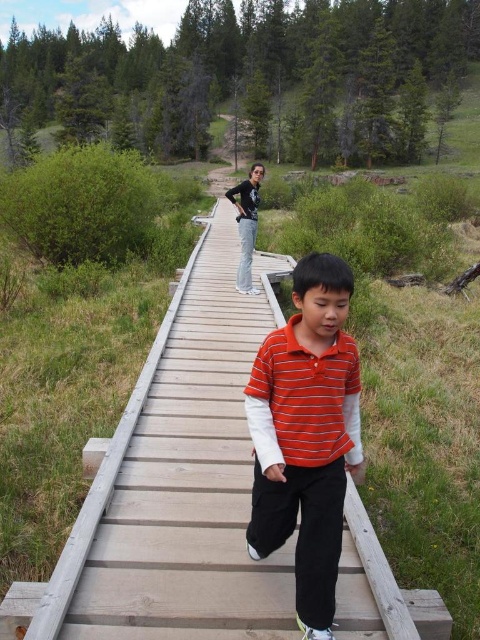
Can you confirm if wooden bridge at center is positioned to the right of orange striped shirt at center?

In fact, wooden bridge at center is to the left of orange striped shirt at center.

Does wooden bridge at center have a larger size compared to orange striped shirt at center?

Correct, wooden bridge at center is larger in size than orange striped shirt at center.

Between point (41, 634) and point (314, 422), which one is positioned in front?

Point (41, 634)

Image resolution: width=480 pixels, height=640 pixels. In order to click on wooden bridge at center in this screenshot , I will do `click(175, 483)`.

From the picture: Is orange striped shirt at center thinner than black cotton pants at center?

No, orange striped shirt at center is not thinner than black cotton pants at center.

Is point (337, 541) farther from camera compared to point (249, 216)?

No.

Find the location of a particular element. The width and height of the screenshot is (480, 640). orange striped shirt at center is located at coordinates (305, 435).

What are the coordinates of `orange striped shirt at center` in the screenshot? It's located at (305, 435).

Can you confirm if wooden bridge at center is positioned to the left of black cotton pants at center?

Yes, wooden bridge at center is to the left of black cotton pants at center.

Is point (162, 452) farther from viewer compared to point (245, 216)?

No, (162, 452) is closer to viewer.

At what (x,y) coordinates should I click in order to perform the action: click on wooden bridge at center. Please return your answer as a coordinate pair (x, y). The width and height of the screenshot is (480, 640). Looking at the image, I should click on (175, 483).